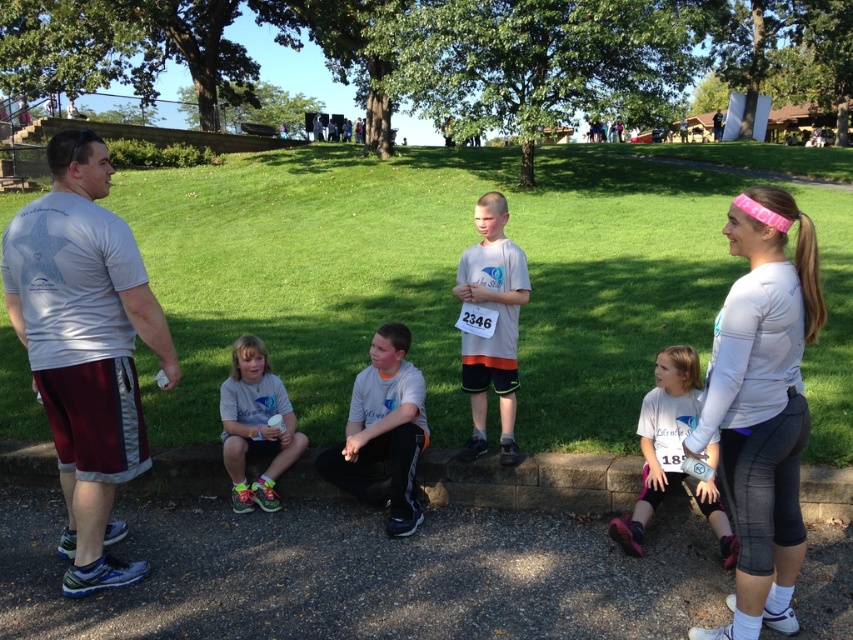
How far apart are matte gray shirt at center and white cotton shirt at upper center?

matte gray shirt at center is 68.37 feet away from white cotton shirt at upper center.

Measure the distance between matte gray shirt at center and white cotton shirt at upper center.

matte gray shirt at center is 68.37 feet from white cotton shirt at upper center.

Is point (231, 454) positioned behind point (596, 120)?

That is False.

I want to click on matte gray shirt at center, so click(x=254, y=426).

Does gray matte shirt at center have a lesser height compared to matte gray shirt at upper center?

Indeed, gray matte shirt at center has a lesser height compared to matte gray shirt at upper center.

Who is higher up, gray matte shirt at center or matte gray shirt at upper center?

matte gray shirt at upper center is above.

Is point (375, 380) positioned behind point (337, 129)?

No, (375, 380) is in front of (337, 129).

The image size is (853, 640). Identify the location of gray matte shirt at center. (383, 433).

Is point (97, 160) in front of point (310, 129)?

Yes.

Which is in front, point (97, 417) or point (314, 115)?

Point (97, 417) is in front.

This screenshot has width=853, height=640. Find the location of `white matte t-shirt at left`. white matte t-shirt at left is located at coordinates (85, 348).